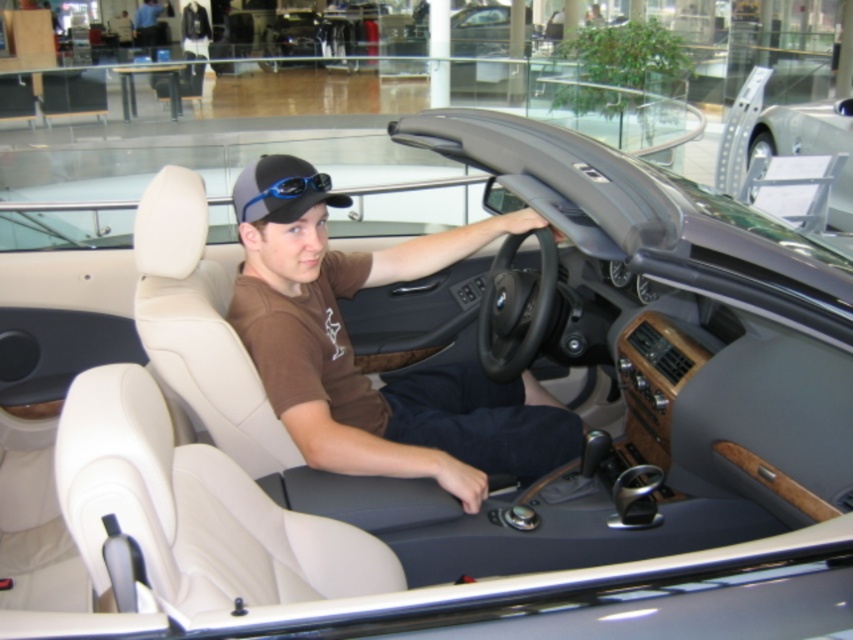
You are standing 5 feet away from the convertible car in the showroom. There is a point at coordinates point (286, 208). Can you reach that point without moving closer to the car?

The distance of point (286, 208) from viewer is 6.32 feet. Since you are only 5 feet away, you are still 1.32 feet away from the point, so you cannot reach it without moving closer.